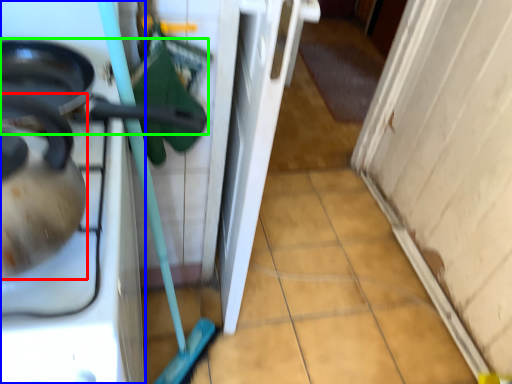
Question: Which object is positioned closest to tea pot (highlighted by a red box)? Select from home appliance (highlighted by a blue box) and frying pan (highlighted by a green box).

Choices:
 (A) home appliance
 (B) frying pan

Answer: (A)